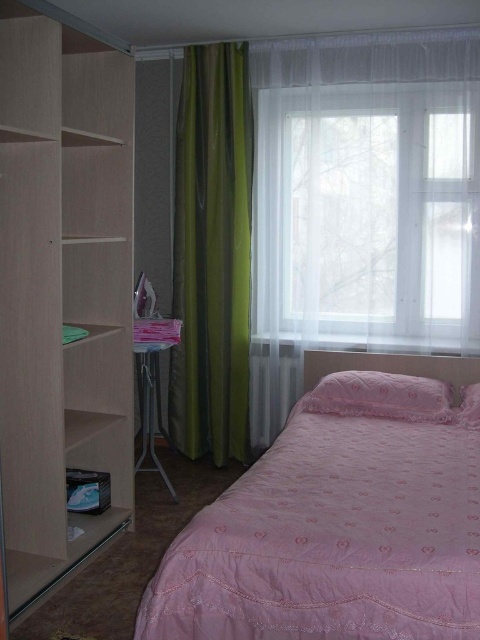
Is green sheer curtain at center to the left of green velvet curtain at center from the viewer's perspective?

No, green sheer curtain at center is not to the left of green velvet curtain at center.

Looking at this image, is green sheer curtain at center bigger than green velvet curtain at center?

Yes.

The width and height of the screenshot is (480, 640). What do you see at coordinates (321, 220) in the screenshot? I see `green sheer curtain at center` at bounding box center [321, 220].

What are the coordinates of `green sheer curtain at center` in the screenshot? It's located at (321, 220).

Does light wood/transparent shelves at left have a lesser height compared to pink satin pillow at right?

Incorrect, light wood/transparent shelves at left's height does not fall short of pink satin pillow at right's.

Who is more forward, (x=2, y=80) or (x=477, y=404)?

Positioned in front is point (x=2, y=80).

I want to click on light wood/transparent shelves at left, so click(62, 296).

Is point (203, 300) in front of point (465, 417)?

No, it is behind (465, 417).

Does point (219, 106) come behind point (476, 387)?

Yes, point (219, 106) is behind point (476, 387).

The image size is (480, 640). I want to click on green velvet curtain at center, so click(x=212, y=253).

Where is `green velvet curtain at center`? This screenshot has height=640, width=480. green velvet curtain at center is located at coordinates (212, 253).